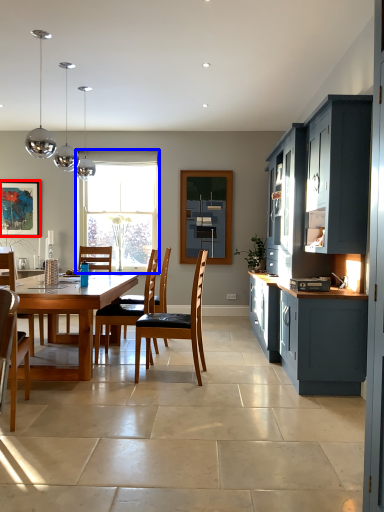
Question: Which of the following is the farthest to the observer, picture frame (highlighted by a red box) or window (highlighted by a blue box)?

Choices:
 (A) picture frame
 (B) window

Answer: (B)